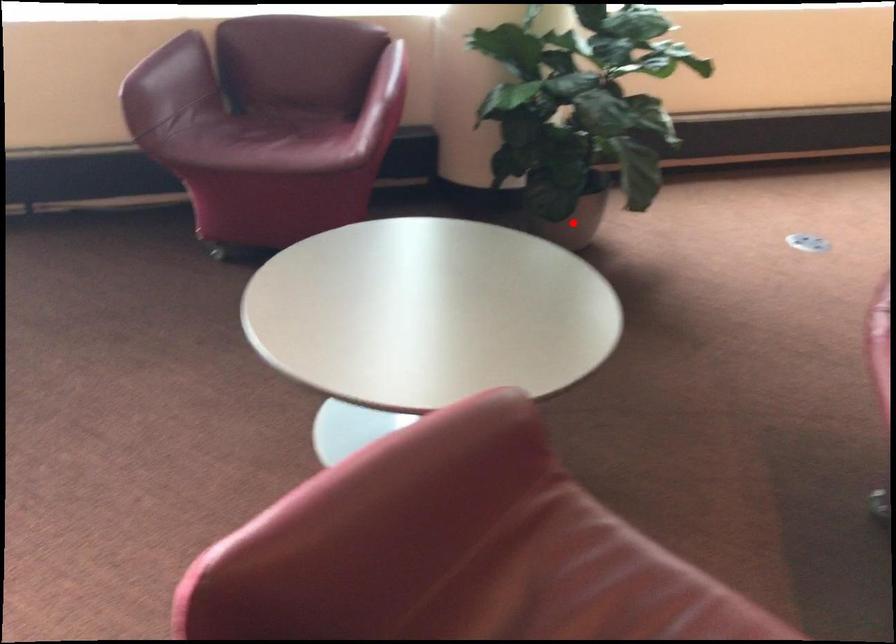
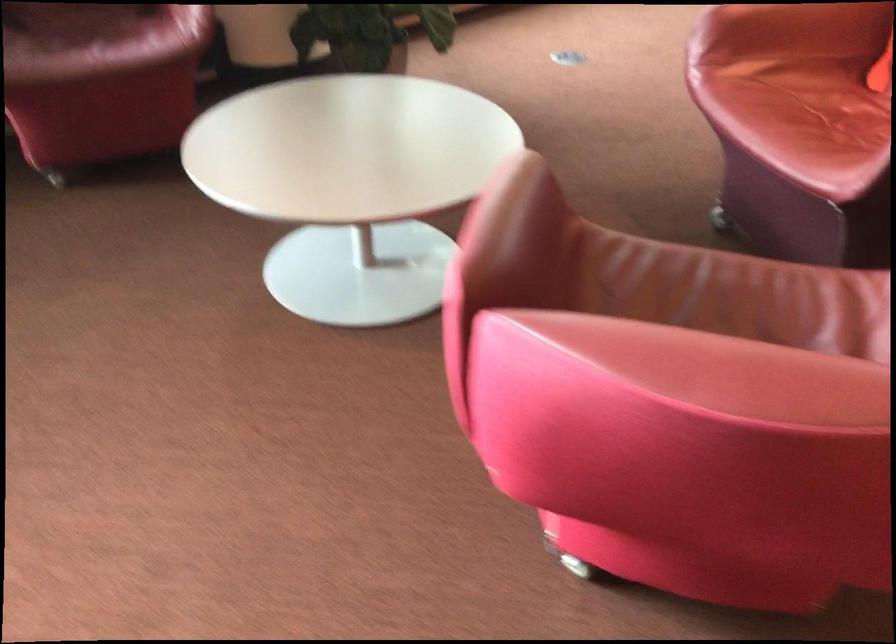
Question: I am providing you with two images of the same scene from different viewpoints. A red point is marked on the first image. Can you still see the location of the red point in image 2?

Choices:
 (A) Yes
 (B) No

Answer: (B)